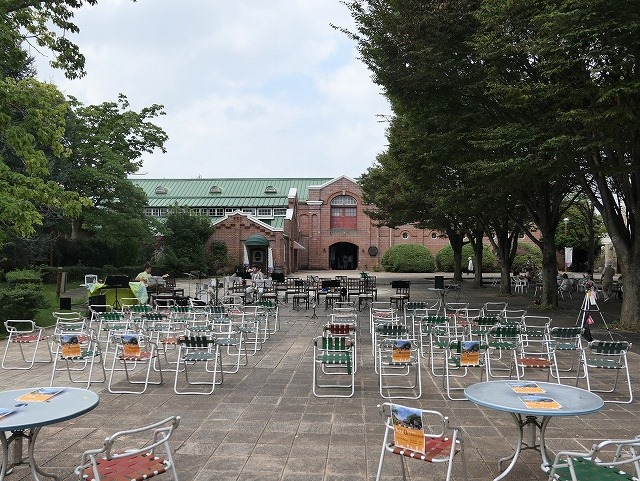
Locate an element on the screen. right table is located at coordinates (579, 389).